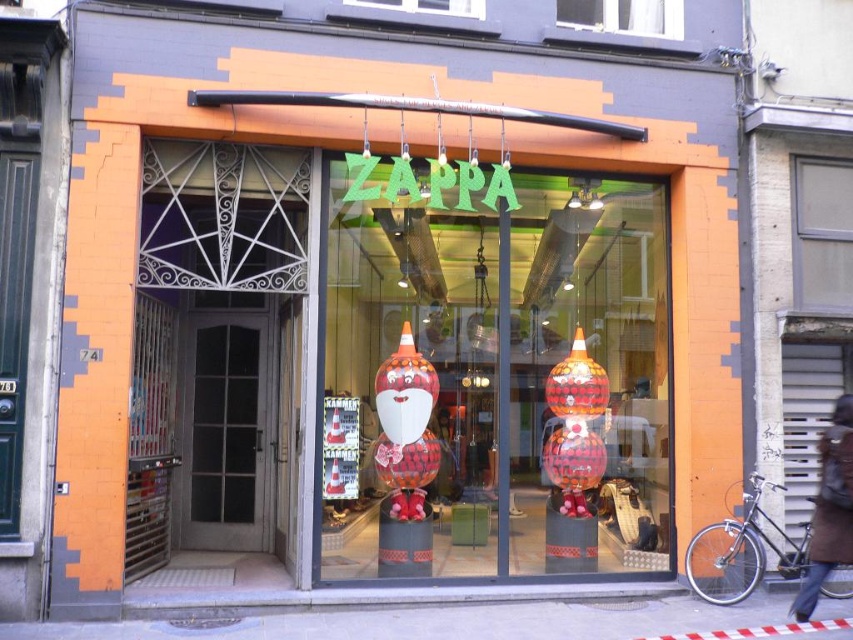
Who is more forward, (666, 346) or (833, 170)?

Point (833, 170) is in front.

Is point (376, 308) positioned after point (838, 253)?

Yes, it is behind point (838, 253).

Describe the element at coordinates (492, 376) in the screenshot. I see `matte red santa at center` at that location.

Where is `matte red santa at center`? The image size is (853, 640). matte red santa at center is located at coordinates (492, 376).

Is transparent glass window at upper right taller than transparent glass window at upper center?

Indeed, transparent glass window at upper right has a greater height compared to transparent glass window at upper center.

Is point (813, 214) positioned after point (576, 3)?

No, it is not.

Locate an element on the screen. The width and height of the screenshot is (853, 640). transparent glass window at upper right is located at coordinates pyautogui.click(x=822, y=234).

Between point (555, 428) and point (584, 6), which one is positioned in front?

Point (584, 6) is more forward.

Measure the distance between point (413, 548) and camera.

The distance of point (413, 548) from camera is 8.03 meters.

Between point (349, 321) and point (561, 22), which one is positioned behind?

Point (349, 321)

Where is `matte red santa at center`? This screenshot has height=640, width=853. matte red santa at center is located at coordinates (492, 376).